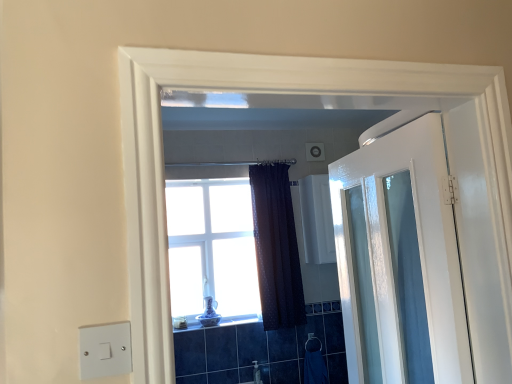
Question: Is white glossy door at right placed right next to clear glass window at center?

Choices:
 (A) no
 (B) yes

Answer: (A)

Question: Is white glossy door at right at the right side of clear glass window at center?

Choices:
 (A) no
 (B) yes

Answer: (B)

Question: Is white glossy door at right oriented away from clear glass window at center?

Choices:
 (A) yes
 (B) no

Answer: (B)

Question: Considering the relative positions of white glossy door at right and clear glass window at center in the image provided, is white glossy door at right behind clear glass window at center?

Choices:
 (A) yes
 (B) no

Answer: (A)

Question: Is white glossy door at right to the left of clear glass window at center from the viewer's perspective?

Choices:
 (A) no
 (B) yes

Answer: (A)

Question: Looking at their shapes, would you say white glossy door at right is wider or thinner than white glossy medicine cabinet at upper center?

Choices:
 (A) thin
 (B) wide

Answer: (A)

Question: Based on their positions, is white glossy door at right located to the left or right of white glossy medicine cabinet at upper center?

Choices:
 (A) right
 (B) left

Answer: (B)

Question: Does point (384, 205) appear closer or farther from the camera than point (309, 177)?

Choices:
 (A) farther
 (B) closer

Answer: (B)

Question: From the image's perspective, is white glossy door at right positioned above or below white glossy medicine cabinet at upper center?

Choices:
 (A) below
 (B) above

Answer: (A)

Question: From the image's perspective, relative to clear glass window at center, is white glossy door at right above or below?

Choices:
 (A) above
 (B) below

Answer: (B)

Question: Would you say white glossy door at right is inside or outside clear glass window at center?

Choices:
 (A) inside
 (B) outside

Answer: (B)

Question: Based on their sizes in the image, would you say white glossy door at right is bigger or smaller than clear glass window at center?

Choices:
 (A) big
 (B) small

Answer: (A)

Question: In the image, is white glossy door at right on the left side or the right side of clear glass window at center?

Choices:
 (A) left
 (B) right

Answer: (B)

Question: Is point (262, 177) positioned closer to the camera than point (355, 61)?

Choices:
 (A) closer
 (B) farther

Answer: (B)

Question: In terms of width, does dark textured curtain at center look wider or thinner when compared to clear glass window at center?

Choices:
 (A) thin
 (B) wide

Answer: (A)